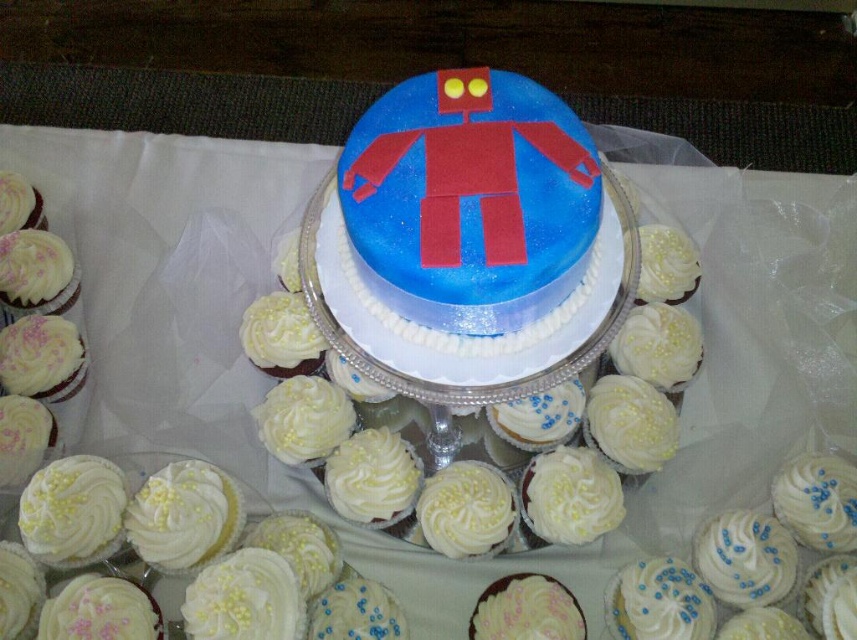
You are a guest at a party and want to take a photo of the blue fondant robot at center and the white frosted cupcake at center. Which one should you focus on first if you want to capture both in the same frame?

You should focus on the white frosted cupcake at center first because the blue fondant robot at center is located above it, so adjusting focus from the lower position to the upper one will ensure both are in the frame.

You are at a party and want to take a photo of the central cake and cupcakes. You need to stand at a point that is 30.81 inches away from the central cake. Is the point at coordinates point (566, 316) suitable for taking the photo?

The distance of point (566, 316) from viewer is 30.81 inches, so yes, the point at coordinates point (566, 316) is suitable for taking the photo as it is exactly 30.81 inches away from the central cake.